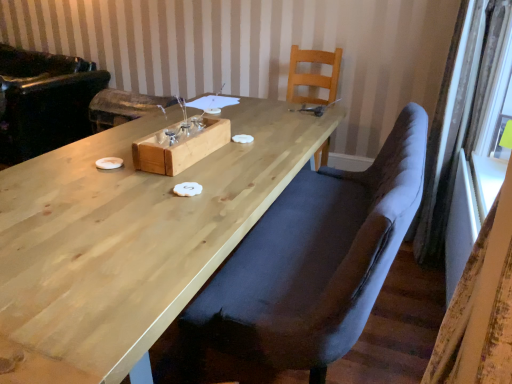
This screenshot has height=384, width=512. In order to click on empty space that is to the right of natural wood tray at center in this screenshot , I will do `click(243, 162)`.